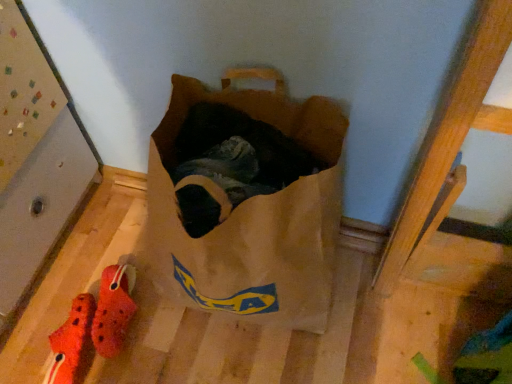
Question: Which is correct: orange fabric slipper at lower left, acting as the second footwear starting from the right, is inside rubberized red croc at lower left, arranged as the second footwear when viewed from the left, or outside of it?

Choices:
 (A) outside
 (B) inside

Answer: (A)

Question: Considering the positions of orange fabric slipper at lower left, acting as the second footwear starting from the right, and rubberized red croc at lower left, arranged as the second footwear when viewed from the left, in the image, is orange fabric slipper at lower left, acting as the second footwear starting from the right, bigger or smaller than rubberized red croc at lower left, arranged as the second footwear when viewed from the left,?

Choices:
 (A) big
 (B) small

Answer: (A)

Question: In terms of height, does orange fabric slipper at lower left, acting as the second footwear starting from the right, look taller or shorter compared to rubberized red croc at lower left, arranged as the second footwear when viewed from the left?

Choices:
 (A) tall
 (B) short

Answer: (A)

Question: From a real-world perspective, is rubberized red croc at lower left, arranged as the second footwear when viewed from the left, positioned above or below orange fabric slipper at lower left, the first footwear viewed from the left?

Choices:
 (A) below
 (B) above

Answer: (B)

Question: In the image, is rubberized red croc at lower left, positioned as the first footwear in right-to-left order, positioned in front of or behind orange fabric slipper at lower left, acting as the second footwear starting from the right?

Choices:
 (A) behind
 (B) front

Answer: (A)

Question: Is point (99, 317) positioned closer to the camera than point (89, 337)?

Choices:
 (A) farther
 (B) closer

Answer: (A)

Question: Considering the positions of rubberized red croc at lower left, arranged as the second footwear when viewed from the left, and orange fabric slipper at lower left, acting as the second footwear starting from the right, in the image, is rubberized red croc at lower left, arranged as the second footwear when viewed from the left, bigger or smaller than orange fabric slipper at lower left, acting as the second footwear starting from the right,?

Choices:
 (A) big
 (B) small

Answer: (B)